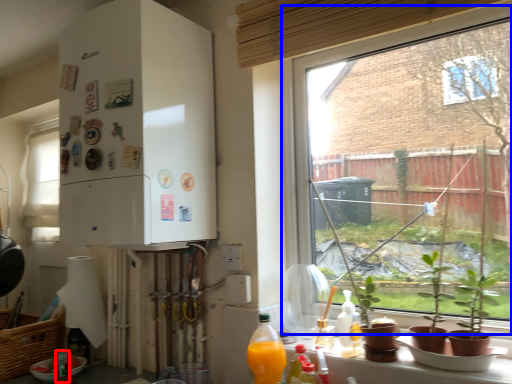
Question: Which of the following is the closest to the observer, bottle (highlighted by a red box) or window (highlighted by a blue box)?

Choices:
 (A) bottle
 (B) window

Answer: (B)